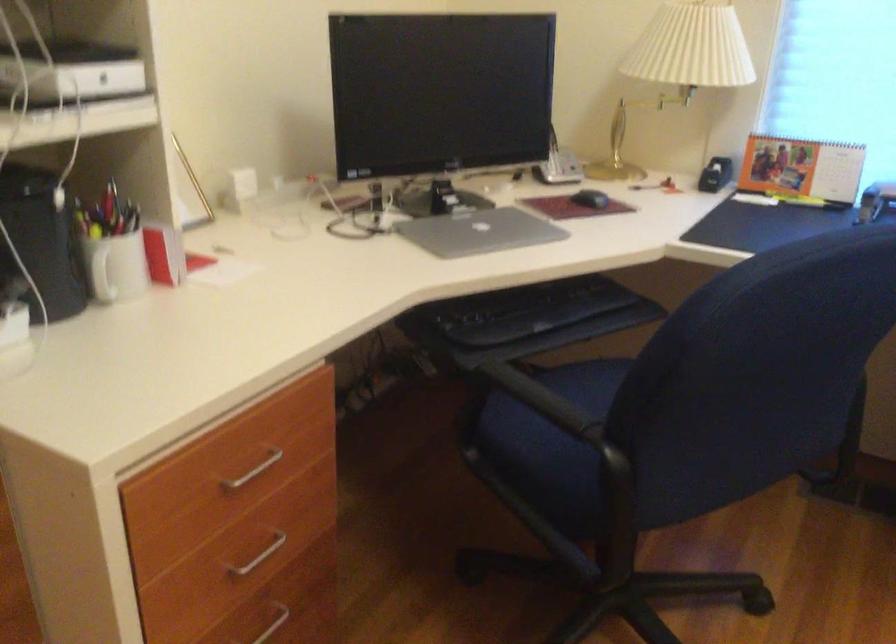
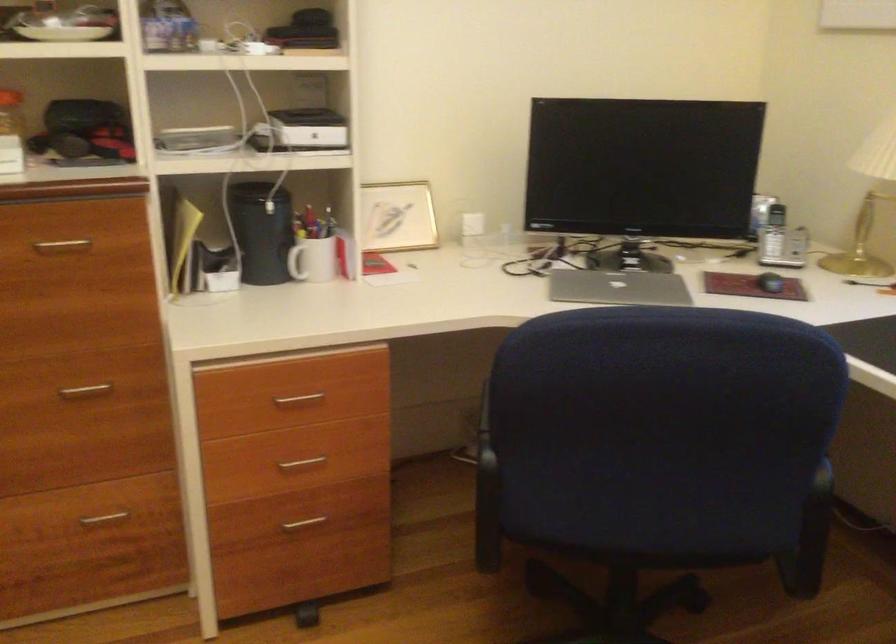
Question: The camera is either moving clockwise (left) or counter-clockwise (right) around the object. The first image is from the beginning of the video and the second image is from the end. Is the camera moving left or right when shooting the video?

Choices:
 (A) Left
 (B) Right

Answer: (B)